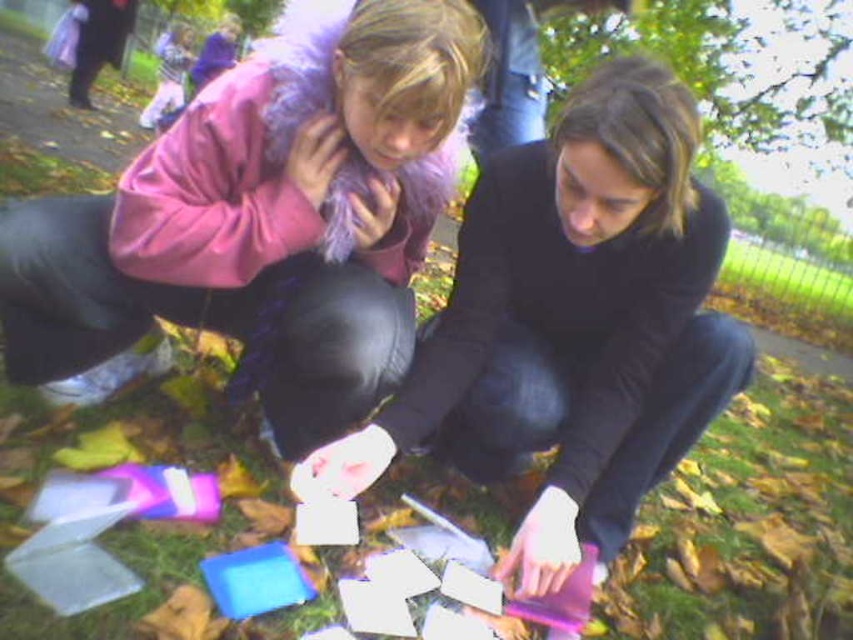
Question: Is matte black jacket at center positioned behind purple glossy phone at lower center?

Choices:
 (A) yes
 (B) no

Answer: (B)

Question: Based on their relative distances, which object is nearer to the purple glossy phone at lower center?

Choices:
 (A) matte black jacket at center
 (B) pink fur coat at upper left

Answer: (A)

Question: Estimate the real-world distances between objects in this image. Which object is farther from the matte black jacket at center?

Choices:
 (A) purple glossy phone at lower center
 (B) pink fur coat at upper left

Answer: (A)

Question: Is matte black jacket at center to the left of purple glossy phone at lower center from the viewer's perspective?

Choices:
 (A) yes
 (B) no

Answer: (A)

Question: Is pink fur coat at upper left wider than purple glossy phone at lower center?

Choices:
 (A) yes
 (B) no

Answer: (A)

Question: Which of these objects is positioned closest to the purple glossy phone at lower center?

Choices:
 (A) matte black jacket at center
 (B) pink fur coat at upper left

Answer: (A)